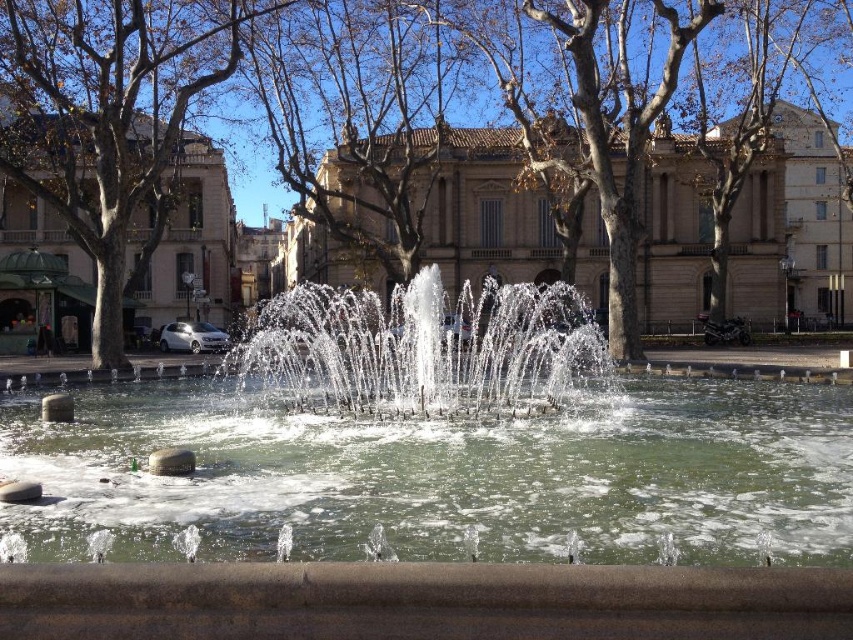
You are standing in the public square and want to take a photo of the fountain. To avoid including the brown leafless tree at center in your photo, which direction should you move relative to the tree?

The brown leafless tree at center is located at point [618,116]. To avoid including it in your photo, move away from the tree towards the opposite direction of its coordinates.

You are a tourist visiting the square and want to take a photo of the clear water fountain at center. However, you notice another tourist standing on the clear water at center. Can you ask them to move so you can get a clear shot of the fountain?

The clear water at center is located below the clear water fountain at center, so the tourist standing on the clear water at center is actually standing directly beneath the fountain. Please ask them to move to capture the fountain without obstruction.

You are standing in the public square and want to find the clear water at center. According to the coordinates provided, where exactly should you look?

The clear water at center is located at the coordinates point (444, 476).